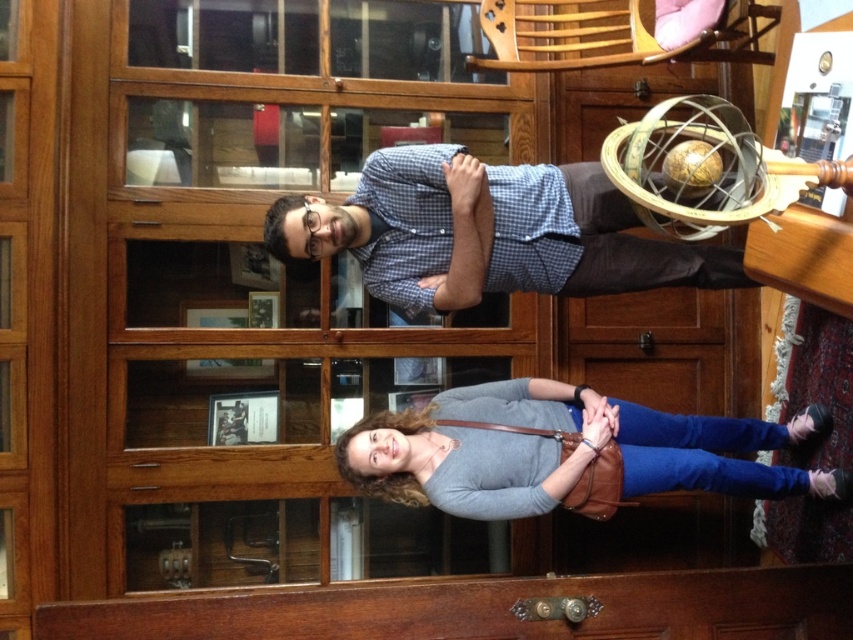
You are standing in a library and see two points marked in the image. Which point, point (x=438, y=248) or point (x=544, y=394), is closer to you?

Point (x=438, y=248) is closer to the viewer than point (x=544, y=394).

You are standing in a library and need to exit through the transparent wood glass door at upper center. There is a matte gray sweater at lower center blocking your path. Can you walk through the door without moving the sweater?

The transparent wood glass door at upper center is larger in size than the matte gray sweater at lower center, so yes, you can walk through the door without moving the sweater since the door is bigger and likely provides enough space around it.

You are an observer standing in front of the two people in the library. You notice the blue checkered shirt at center and the matte gray sweater at lower center. Which of these two items is narrower in width?

The blue checkered shirt at center is thinner than the matte gray sweater at lower center, so the blue checkered shirt at center is narrower in width.